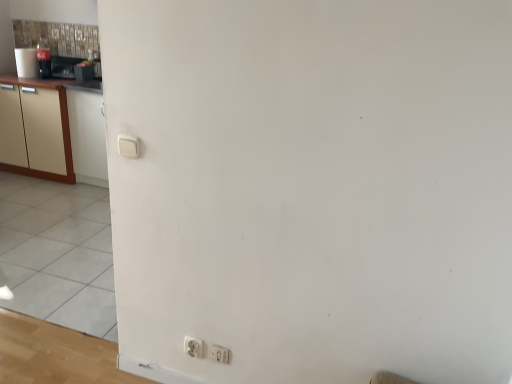
Question: From a real-world perspective, is white plastic electric outlet at lower center, which is counted as the second electric outlet, starting from the right, physically above beige wood cabinetry at left?

Choices:
 (A) no
 (B) yes

Answer: (A)

Question: Considering the relative positions of white plastic electric outlet at lower center, which appears as the first electric outlet when viewed from the left, and beige wood cabinetry at left in the image provided, is white plastic electric outlet at lower center, which appears as the first electric outlet when viewed from the left, to the right of beige wood cabinetry at left from the viewer's perspective?

Choices:
 (A) no
 (B) yes

Answer: (B)

Question: From a real-world perspective, is white plastic electric outlet at lower center, which appears as the first electric outlet when viewed from the left, beneath beige wood cabinetry at left?

Choices:
 (A) no
 (B) yes

Answer: (B)

Question: Considering the relative sizes of white plastic electric outlet at lower center, which appears as the first electric outlet when viewed from the left, and beige wood cabinetry at left in the image provided, is white plastic electric outlet at lower center, which appears as the first electric outlet when viewed from the left, shorter than beige wood cabinetry at left?

Choices:
 (A) no
 (B) yes

Answer: (B)

Question: Are white plastic electric outlet at lower center, which is counted as the second electric outlet, starting from the right, and beige wood cabinetry at left making contact?

Choices:
 (A) yes
 (B) no

Answer: (B)

Question: From a real-world perspective, is metallic silver toaster at upper left positioned above or below white plastic electric outlet at lower center, which is counted as the second electric outlet, starting from the right?

Choices:
 (A) below
 (B) above

Answer: (B)

Question: Is point (74, 74) closer or farther from the camera than point (195, 347)?

Choices:
 (A) closer
 (B) farther

Answer: (B)

Question: Is metallic silver toaster at upper left wider or thinner than white plastic electric outlet at lower center, which is counted as the second electric outlet, starting from the right?

Choices:
 (A) thin
 (B) wide

Answer: (B)

Question: In the image, is metallic silver toaster at upper left on the left side or the right side of white plastic electric outlet at lower center, which is counted as the second electric outlet, starting from the right?

Choices:
 (A) left
 (B) right

Answer: (A)

Question: From the image's perspective, is metallic silver toaster at upper left located above or below beige wood cabinetry at left?

Choices:
 (A) below
 (B) above

Answer: (B)

Question: Would you say metallic silver toaster at upper left is inside or outside beige wood cabinetry at left?

Choices:
 (A) outside
 (B) inside

Answer: (A)

Question: Is metallic silver toaster at upper left to the left or to the right of beige wood cabinetry at left in the image?

Choices:
 (A) right
 (B) left

Answer: (A)

Question: Is metallic silver toaster at upper left wider or thinner than beige wood cabinetry at left?

Choices:
 (A) wide
 (B) thin

Answer: (B)

Question: Considering their positions, is white plastic electric outlet at lower center, the second electric outlet when ordered from left to right, located in front of or behind white plastic electric outlet at lower center, which appears as the first electric outlet when viewed from the left?

Choices:
 (A) front
 (B) behind

Answer: (A)

Question: Considering the positions of white plastic electric outlet at lower center, which is the 1th electric outlet in right-to-left order, and white plastic electric outlet at lower center, which is counted as the second electric outlet, starting from the right, in the image, is white plastic electric outlet at lower center, which is the 1th electric outlet in right-to-left order, taller or shorter than white plastic electric outlet at lower center, which is counted as the second electric outlet, starting from the right,?

Choices:
 (A) short
 (B) tall

Answer: (A)